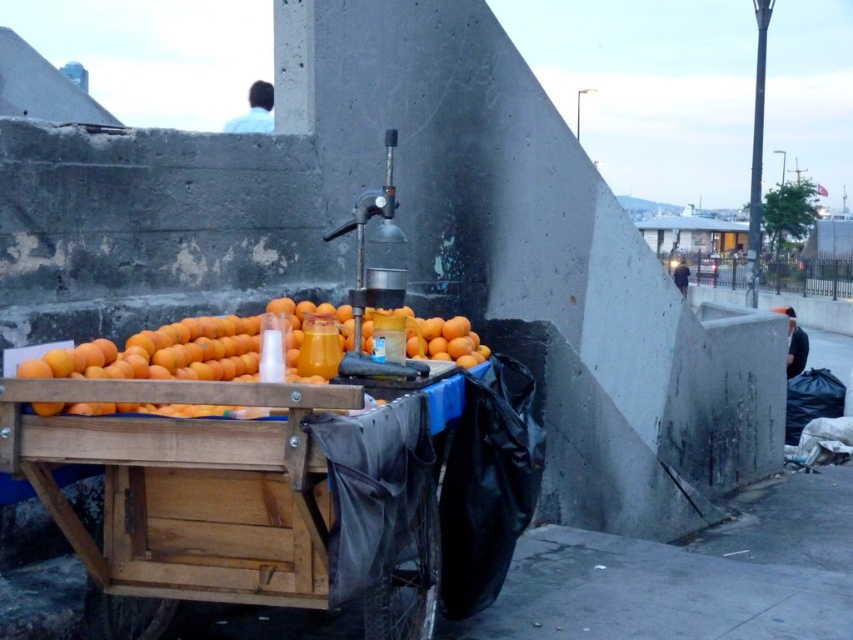
Question: Is dark blue shirt at lower right smaller than dark blue fabric at right?

Choices:
 (A) yes
 (B) no

Answer: (A)

Question: Does orange matte at center come behind dark blue fabric at right?

Choices:
 (A) no
 (B) yes

Answer: (A)

Question: Estimate the real-world distances between objects in this image. Which object is closer to the orange matte at center?

Choices:
 (A) light blue shirt at upper center
 (B) dark blue fabric at right
 (C) wooden cart at lower left

Answer: (C)

Question: Does wooden cart at lower left appear on the right side of dark blue fabric at right?

Choices:
 (A) no
 (B) yes

Answer: (A)

Question: Which object is the closest to the light blue shirt at upper center?

Choices:
 (A) dark blue fabric at right
 (B) wooden cart at lower left
 (C) orange matte at center

Answer: (C)

Question: Which is nearer to the dark blue fabric at right?

Choices:
 (A) dark blue shirt at lower right
 (B) orange matte at center
 (C) light blue shirt at upper center

Answer: (A)